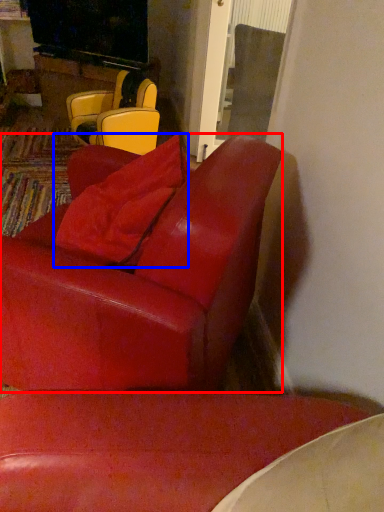
Question: Which object is further to the camera taking this photo, chair (highlighted by a red box) or pillow (highlighted by a blue box)?

Choices:
 (A) chair
 (B) pillow

Answer: (B)